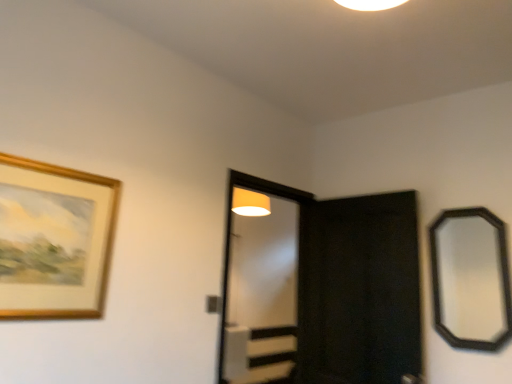
Question: Considering the relative positions of gold wooden picture frame at upper left and black matte screen door at center, marked as the second screen door in a left-to-right arrangement, in the image provided, is gold wooden picture frame at upper left to the left of black matte screen door at center, marked as the second screen door in a left-to-right arrangement, from the viewer's perspective?

Choices:
 (A) yes
 (B) no

Answer: (A)

Question: Is gold wooden picture frame at upper left taller than black matte screen door at center, placed as the 1th screen door when sorted from right to left?

Choices:
 (A) no
 (B) yes

Answer: (A)

Question: Does gold wooden picture frame at upper left have a lesser width compared to black matte screen door at center, placed as the 1th screen door when sorted from right to left?

Choices:
 (A) yes
 (B) no

Answer: (A)

Question: Can you confirm if gold wooden picture frame at upper left is bigger than black matte screen door at center, marked as the second screen door in a left-to-right arrangement?

Choices:
 (A) no
 (B) yes

Answer: (A)

Question: Can you confirm if gold wooden picture frame at upper left is smaller than black matte screen door at center, placed as the 1th screen door when sorted from right to left?

Choices:
 (A) no
 (B) yes

Answer: (B)

Question: Is gold wooden picture frame at upper left further to camera compared to black matte screen door at center, marked as the second screen door in a left-to-right arrangement?

Choices:
 (A) no
 (B) yes

Answer: (A)

Question: Does black matte screen door at center, marked as the second screen door in a left-to-right arrangement, appear on the left side of gold wooden picture frame at upper left?

Choices:
 (A) yes
 (B) no

Answer: (B)

Question: Considering the relative positions of black matte screen door at center, marked as the second screen door in a left-to-right arrangement, and gold wooden picture frame at upper left in the image provided, is black matte screen door at center, marked as the second screen door in a left-to-right arrangement, in front of gold wooden picture frame at upper left?

Choices:
 (A) yes
 (B) no

Answer: (B)

Question: Is black matte screen door at center, marked as the second screen door in a left-to-right arrangement, facing away from gold wooden picture frame at upper left?

Choices:
 (A) yes
 (B) no

Answer: (B)

Question: Can you confirm if black matte screen door at center, placed as the 1th screen door when sorted from right to left, is taller than gold wooden picture frame at upper left?

Choices:
 (A) no
 (B) yes

Answer: (B)

Question: Does black matte screen door at center, marked as the second screen door in a left-to-right arrangement, have a greater width compared to gold wooden picture frame at upper left?

Choices:
 (A) no
 (B) yes

Answer: (B)

Question: Does black matte screen door at center, placed as the 1th screen door when sorted from right to left, contain gold wooden picture frame at upper left?

Choices:
 (A) yes
 (B) no

Answer: (B)

Question: Is the depth of black matte screen door at center, marked as the second screen door in a left-to-right arrangement, greater than that of black wooden mirror at right?

Choices:
 (A) no
 (B) yes

Answer: (B)